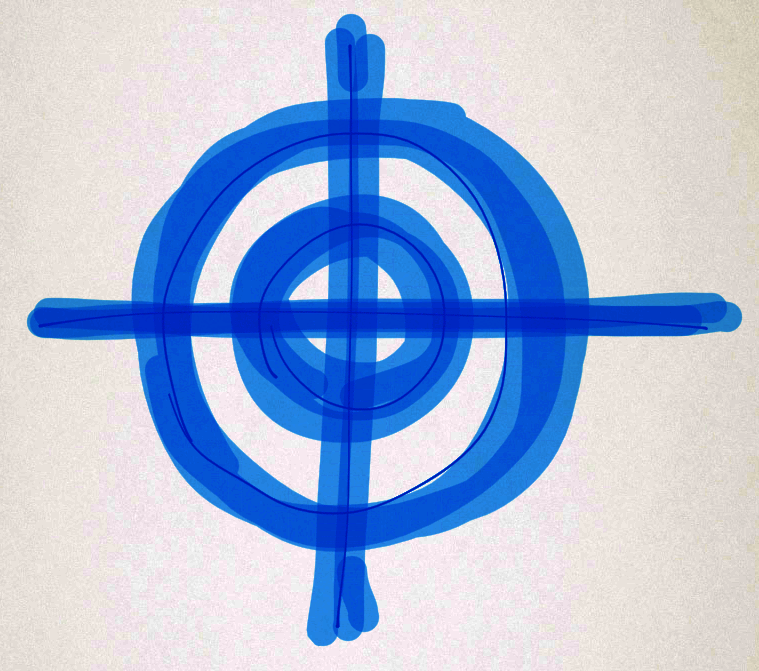
You are a GUI agent. You are given a task and a screenshot of the screen. Output one action in this format:
    pyautogui.click(x=<x>, y=<y>)
    Task: Click on the light blue shade
    This screenshot has width=759, height=671.
    Given the screenshot: What is the action you would take?
    pyautogui.click(x=323, y=600), pyautogui.click(x=147, y=268), pyautogui.click(x=490, y=503), pyautogui.click(x=407, y=111), pyautogui.click(x=354, y=25)